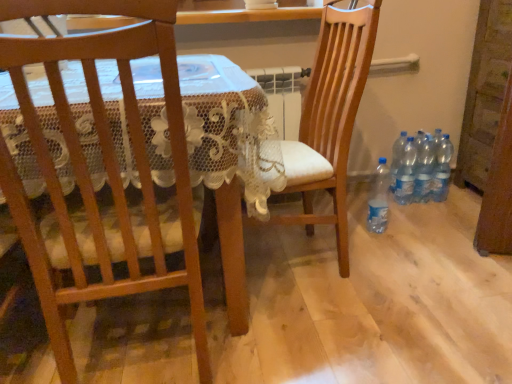
At what (x,y) coordinates should I click in order to perform the action: click on free point behind clear plastic bottle at lower right, which appears as the 1th bottle when viewed from the left. Please return your answer as a coordinate pair (x, y). This screenshot has width=512, height=384. Looking at the image, I should click on (364, 215).